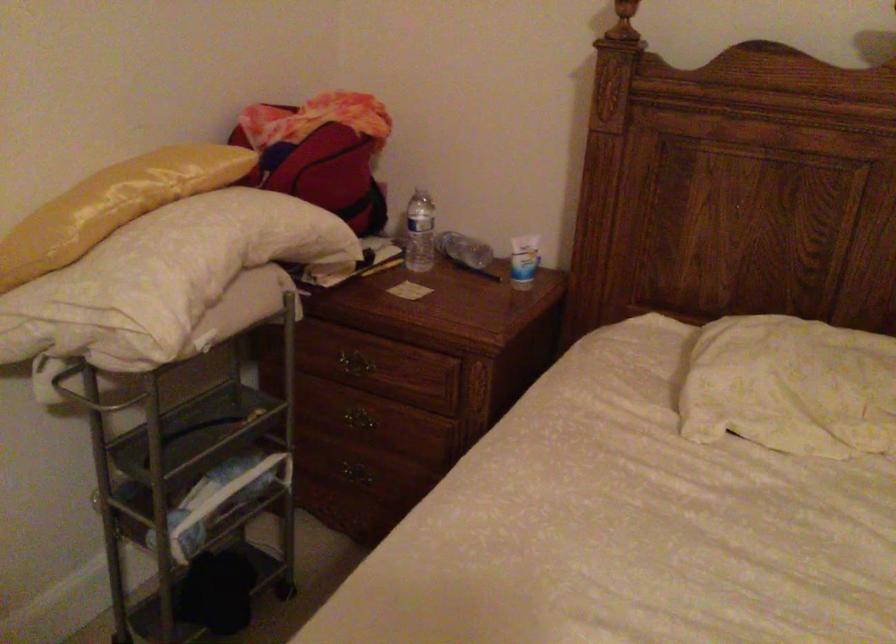
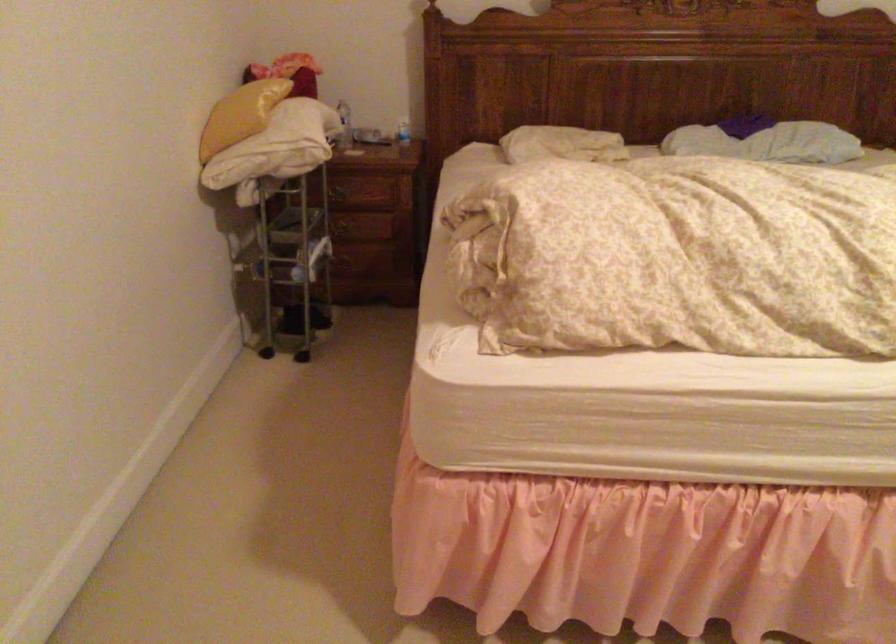
Locate, in the second image, the point that corresponds to (349,251) in the first image.

(343, 125)